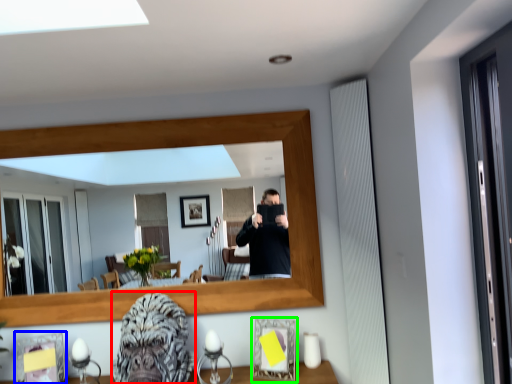
Question: Which object is positioned farthest from gorilla (highlighted by a red box)? Select from picture frame (highlighted by a blue box) and picture frame (highlighted by a green box).

Choices:
 (A) picture frame
 (B) picture frame

Answer: (A)